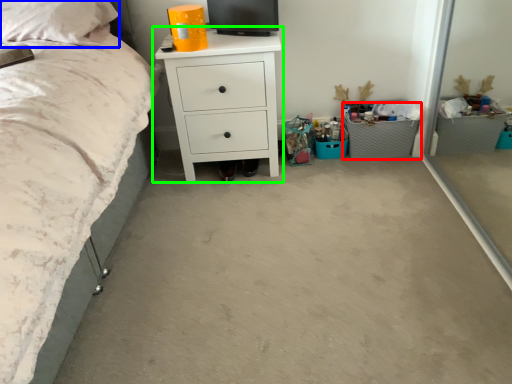
Question: Which object is the farthest from crate (highlighted by a red box)? Choose among these: pillow (highlighted by a blue box) or chest of drawers (highlighted by a green box).

Choices:
 (A) pillow
 (B) chest of drawers

Answer: (A)